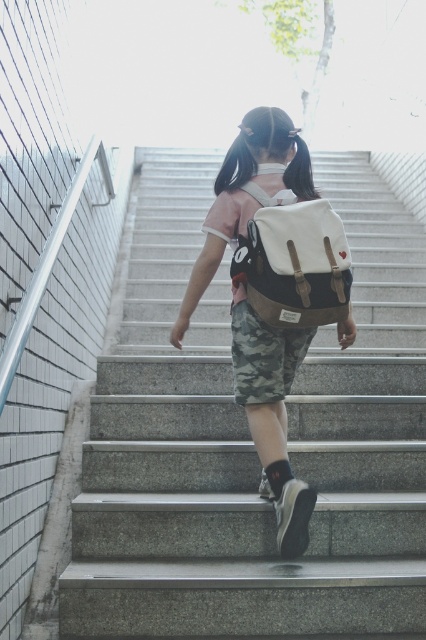
You are standing at the bottom of the stairs and want to reach the top. There are two points marked on the wall next to the stairs. Which point is closer to you, point (273, 260) or point (288, 371)?

Point (273, 260) is closer to the viewer than point (288, 371), so the closer point is point (273, 260).